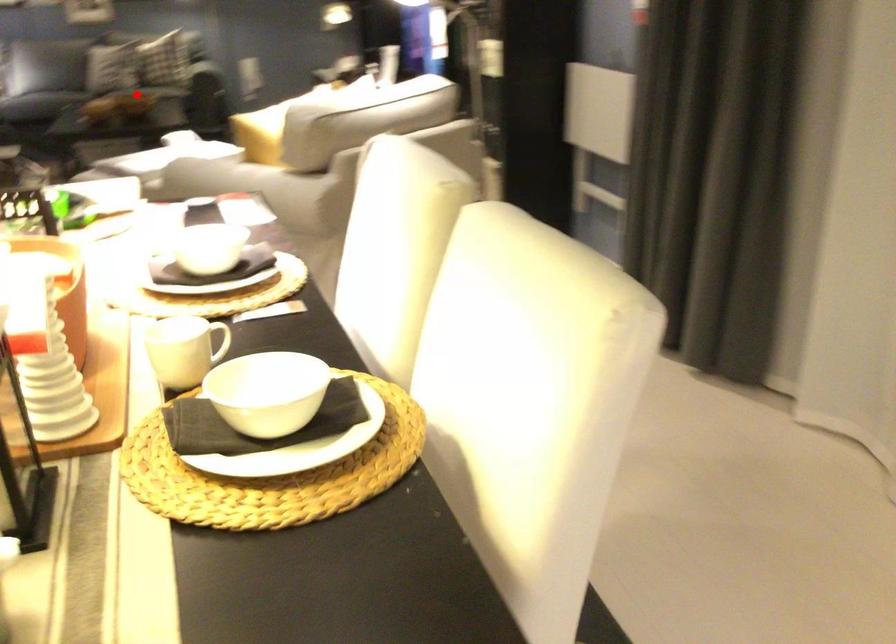
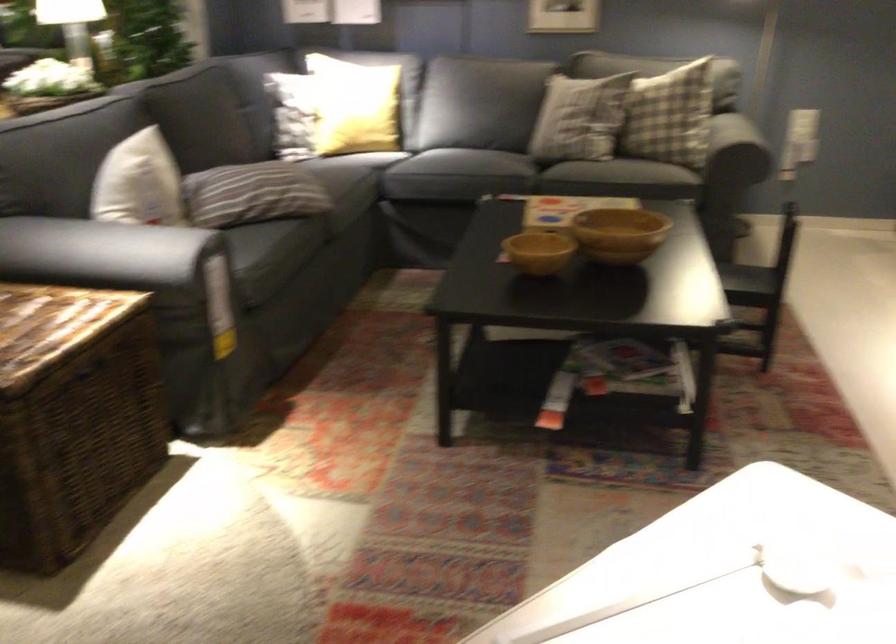
The point at the highlighted location is marked in the first image. Where is the corresponding point in the second image?

(618, 234)